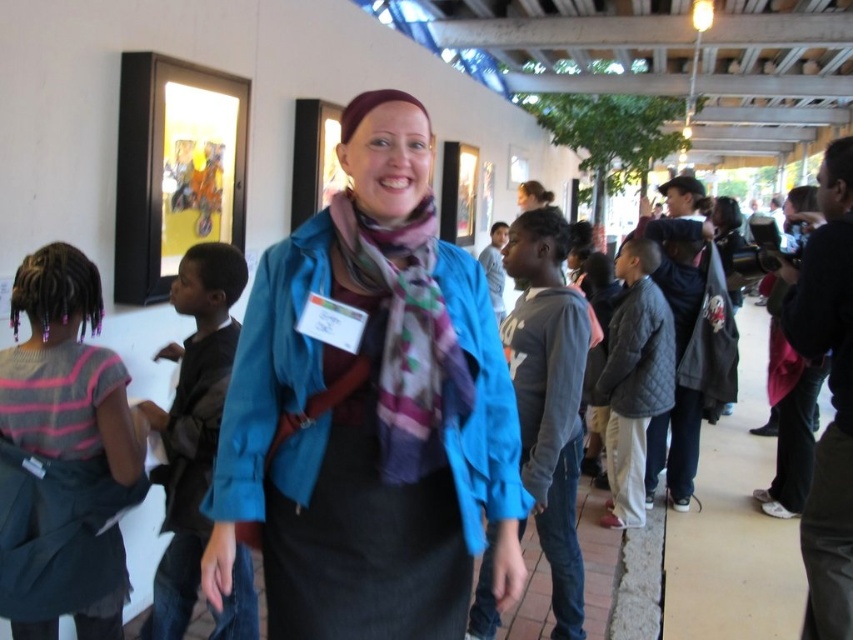
Does blue fabric jacket at center appear over striped cotton shirt at left?

Indeed, blue fabric jacket at center is positioned over striped cotton shirt at left.

Who is higher up, blue fabric jacket at center or striped cotton shirt at left?

blue fabric jacket at center

Who is more distant from viewer, (291, 486) or (10, 483)?

Point (10, 483)

Where is `blue fabric jacket at center`? This screenshot has height=640, width=853. blue fabric jacket at center is located at coordinates (369, 412).

Between point (344, 404) and point (370, 264), which one is positioned behind?

Positioned behind is point (370, 264).

Is blue fabric jacket at center above multicolored woven scarf at center?

Incorrect, blue fabric jacket at center is not positioned above multicolored woven scarf at center.

Is point (321, 220) more distant than point (427, 419)?

Yes, it is behind point (427, 419).

I want to click on blue fabric jacket at center, so click(369, 412).

Can you confirm if striped cotton shirt at left is positioned to the left of dark blue shirt at center?

Indeed, striped cotton shirt at left is positioned on the left side of dark blue shirt at center.

The image size is (853, 640). What do you see at coordinates (62, 456) in the screenshot?
I see `striped cotton shirt at left` at bounding box center [62, 456].

The height and width of the screenshot is (640, 853). What are the coordinates of `striped cotton shirt at left` in the screenshot? It's located at (62, 456).